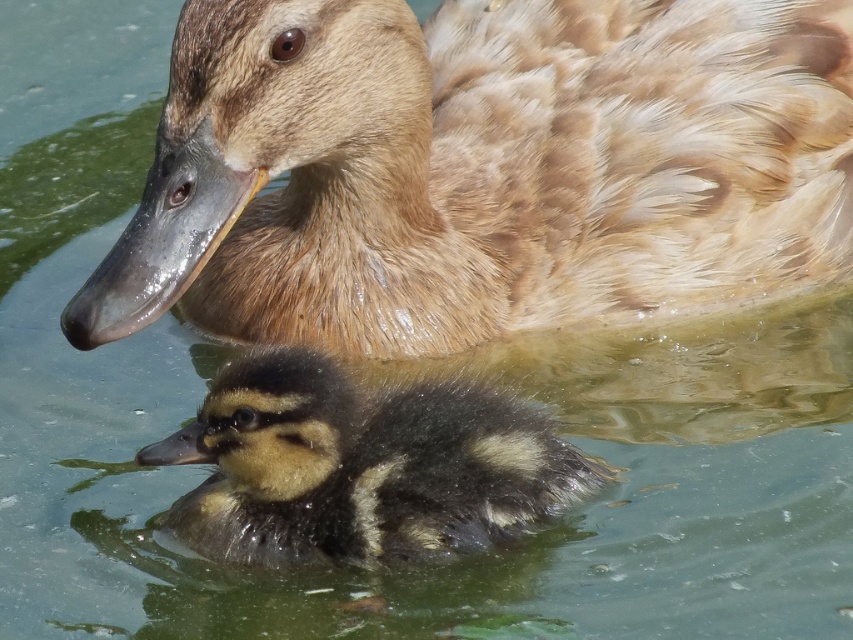
Does brown feathered duck at upper center have a lesser width compared to black fuzzy duckling at center?

Incorrect, brown feathered duck at upper center's width is not less than black fuzzy duckling at center's.

Who is more distant from viewer, (619, 221) or (537, 492)?

The point (619, 221) is behind.

Where is `brown feathered duck at upper center`? Image resolution: width=853 pixels, height=640 pixels. brown feathered duck at upper center is located at coordinates (480, 168).